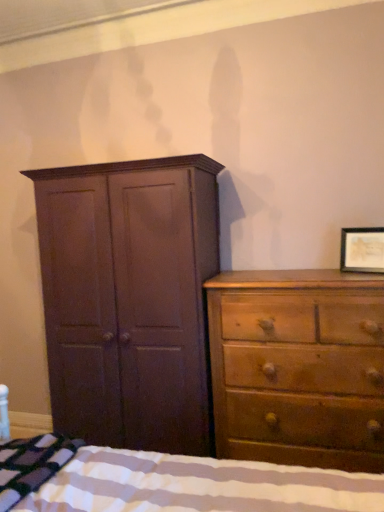
Question: Is striped cotton blanket at lower left to the right of light brown wood dresser at right from the viewer's perspective?

Choices:
 (A) no
 (B) yes

Answer: (A)

Question: Considering the relative sizes of striped cotton blanket at lower left and light brown wood dresser at right in the image provided, is striped cotton blanket at lower left smaller than light brown wood dresser at right?

Choices:
 (A) yes
 (B) no

Answer: (A)

Question: Can you confirm if striped cotton blanket at lower left is wider than light brown wood dresser at right?

Choices:
 (A) no
 (B) yes

Answer: (B)

Question: Are striped cotton blanket at lower left and light brown wood dresser at right making contact?

Choices:
 (A) yes
 (B) no

Answer: (B)

Question: From the image's perspective, is striped cotton blanket at lower left located beneath light brown wood dresser at right?

Choices:
 (A) yes
 (B) no

Answer: (A)

Question: Does striped cotton blanket at lower left lie behind light brown wood dresser at right?

Choices:
 (A) no
 (B) yes

Answer: (A)

Question: From the image's perspective, is light brown wood dresser at right on top of wooden framed picture at upper right?

Choices:
 (A) no
 (B) yes

Answer: (A)

Question: Is light brown wood dresser at right wider than wooden framed picture at upper right?

Choices:
 (A) yes
 (B) no

Answer: (A)

Question: Is light brown wood dresser at right to the left of wooden framed picture at upper right from the viewer's perspective?

Choices:
 (A) no
 (B) yes

Answer: (B)

Question: Is light brown wood dresser at right further to camera compared to wooden framed picture at upper right?

Choices:
 (A) no
 (B) yes

Answer: (A)

Question: Is light brown wood dresser at right positioned far away from wooden framed picture at upper right?

Choices:
 (A) no
 (B) yes

Answer: (A)

Question: Does light brown wood dresser at right lie in front of wooden framed picture at upper right?

Choices:
 (A) no
 (B) yes

Answer: (B)

Question: Is striped fabric bed at lower left looking in the opposite direction of wooden framed picture at upper right?

Choices:
 (A) no
 (B) yes

Answer: (A)